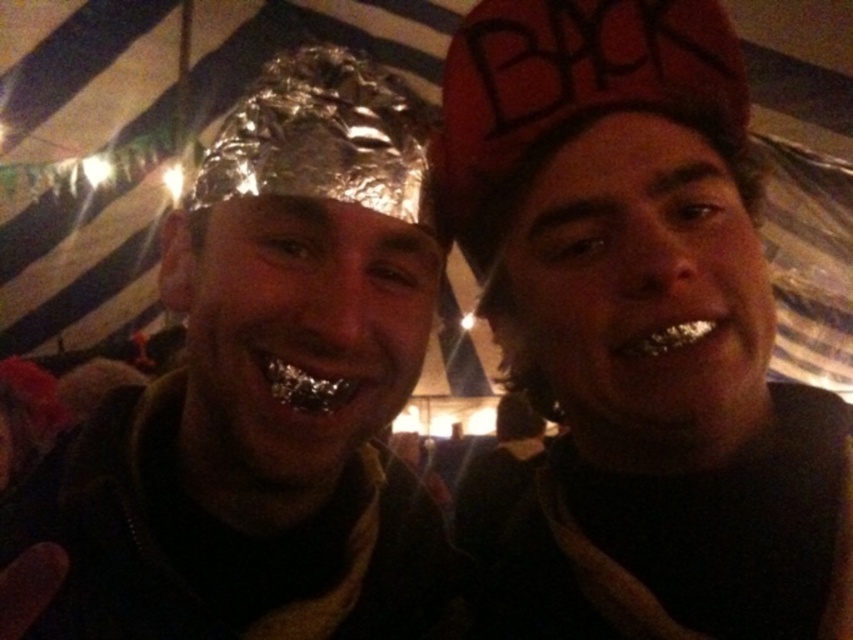
Who is positioned more to the left, shiny metallic foil hat at left or shiny metallic foil at center?

From the viewer's perspective, shiny metallic foil hat at left appears more on the left side.

Which is in front, point (256, 483) or point (291, 56)?

Point (256, 483) is more forward.

Does point (323, 442) lie behind point (280, 396)?

Yes, it is behind point (280, 396).

This screenshot has width=853, height=640. Find the location of `shiny metallic foil hat at left`. shiny metallic foil hat at left is located at coordinates (265, 394).

Is shiny metallic foil hat at left thinner than metallic silver teeth at lower right?

Incorrect, shiny metallic foil hat at left's width is not less than metallic silver teeth at lower right's.

Does shiny metallic foil hat at left appear under metallic silver teeth at lower right?

Incorrect, shiny metallic foil hat at left is not positioned below metallic silver teeth at lower right.

Is point (117, 444) behind point (648, 356)?

Yes, it is behind point (648, 356).

Where is `shiny metallic foil hat at left`? This screenshot has width=853, height=640. shiny metallic foil hat at left is located at coordinates (265, 394).

Is the position of shiny metallic foil at center less distant than that of metallic silver teeth at lower right?

That is True.

Does point (311, 454) lie behind point (627, 348)?

No.

You are a GUI agent. You are given a task and a screenshot of the screen. Output one action in this format:
    pyautogui.click(x=<x>, y=<y>)
    Task: Click on the shiny metallic foil at center
    The height and width of the screenshot is (640, 853).
    Given the screenshot: What is the action you would take?
    pyautogui.click(x=308, y=260)